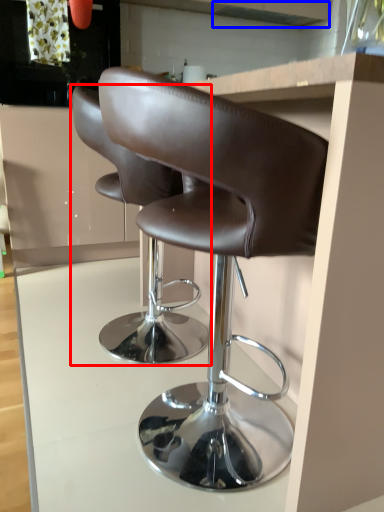
Question: Which object appears farthest to the camera in this image, chair (highlighted by a red box) or exhaust hood (highlighted by a blue box)?

Choices:
 (A) chair
 (B) exhaust hood

Answer: (B)